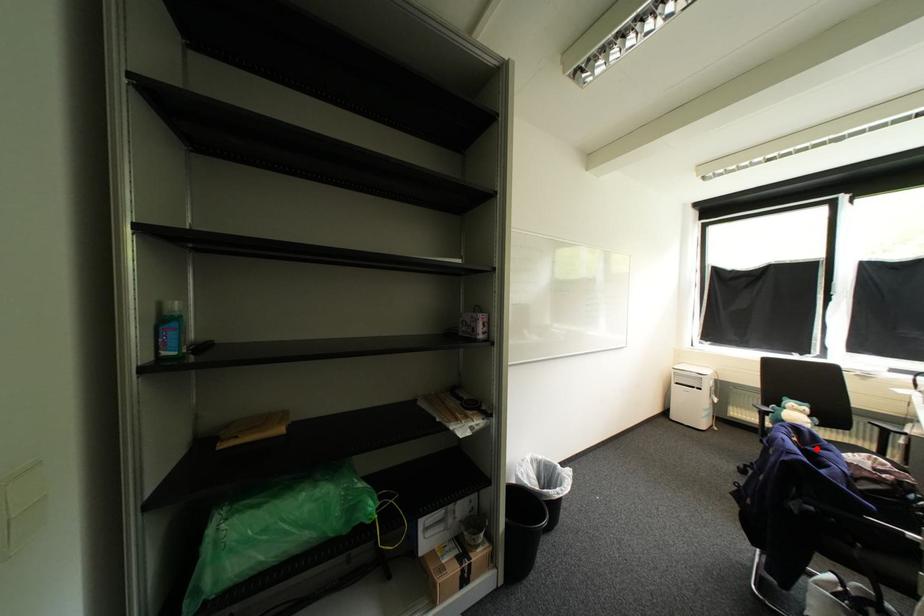
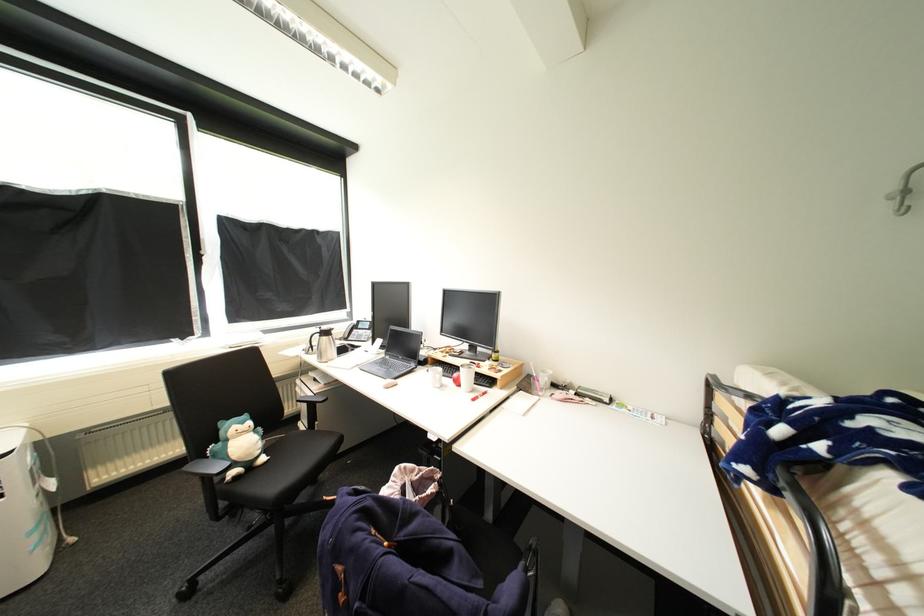
Find the pixel in the second image that matches the highlighted location in the first image.

(408, 537)